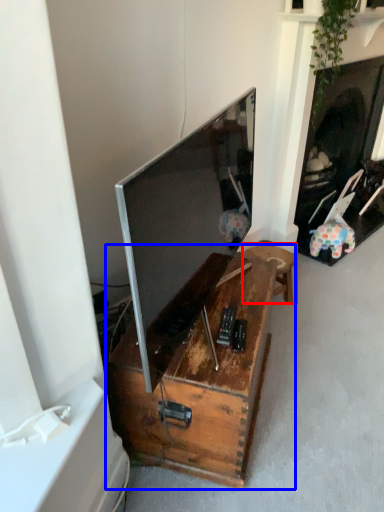
Question: Which of the following is the farthest to the observer, furniture (highlighted by a red box) or table (highlighted by a blue box)?

Choices:
 (A) furniture
 (B) table

Answer: (A)